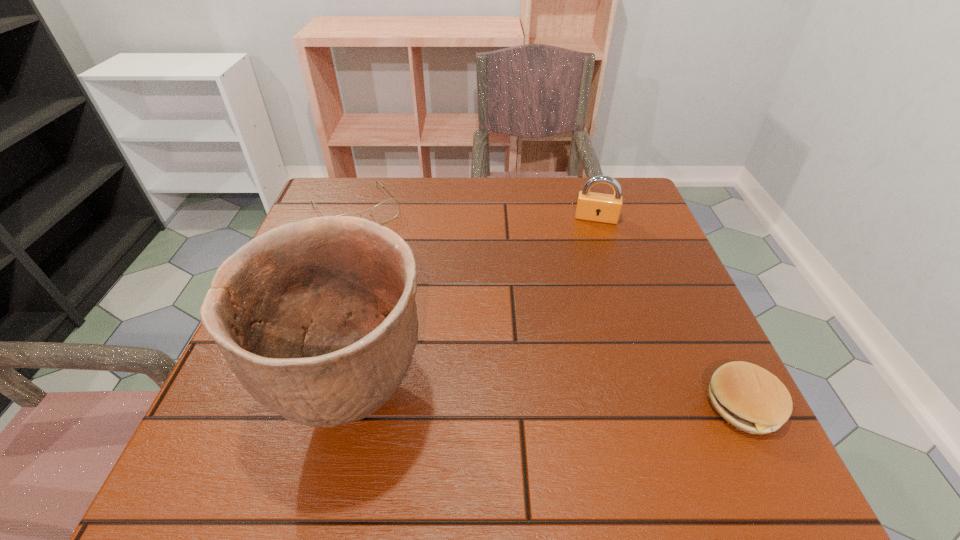
Identify the location of free space at the near right corner of the desktop. The width and height of the screenshot is (960, 540). (694, 407).

Locate an element on the screen. This screenshot has height=540, width=960. free spot between the second object from right to left and the tallest object is located at coordinates (475, 308).

This screenshot has width=960, height=540. What are the coordinates of `empty space that is in between the spectacles and the rightmost object` in the screenshot? It's located at (549, 308).

Image resolution: width=960 pixels, height=540 pixels. In order to click on vacant area that lies between the rightmost object and the tallest object in this screenshot , I will do `click(548, 401)`.

The image size is (960, 540). What are the coordinates of `vacant area that lies between the pottery and the padlock` in the screenshot? It's located at (475, 308).

The width and height of the screenshot is (960, 540). I want to click on free space between the pottery and the padlock, so click(x=475, y=308).

Find the location of a particular element. The height and width of the screenshot is (540, 960). empty location between the pottery and the padlock is located at coordinates [x=475, y=308].

Find the location of a particular element. free space between the spectacles and the third object from left to right is located at coordinates (476, 214).

Find the location of a particular element. object that stands as the closest to the spectacles is located at coordinates (317, 319).

Where is `object that can be found as the second closest to the pottery`? object that can be found as the second closest to the pottery is located at coordinates (750, 398).